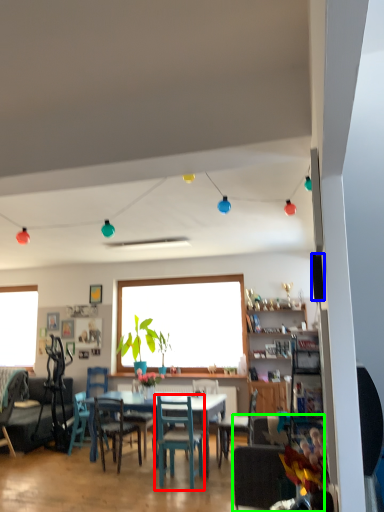
Question: Based on their relative distances, which object is farther from chair (highlighted by a red box)? Choose from loudspeaker (highlighted by a blue box) and chair (highlighted by a green box).

Choices:
 (A) loudspeaker
 (B) chair

Answer: (A)